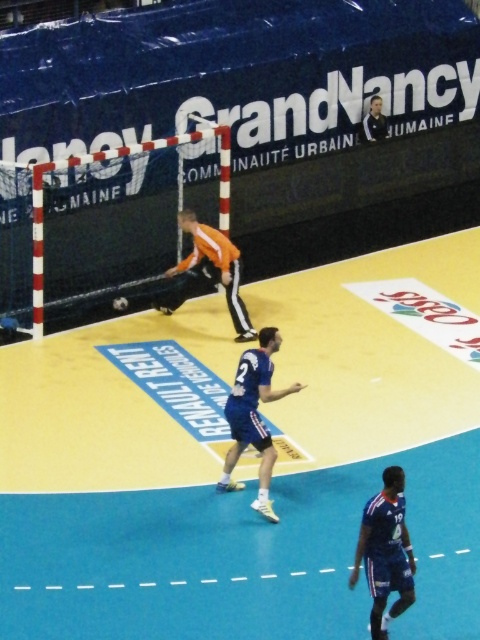
Question: Which object appears farthest from the camera in this image?

Choices:
 (A) blue fabric jersey at lower right
 (B) blue fabric jersey at center
 (C) orange jersey at center

Answer: (C)

Question: Can you confirm if blue synthetic court at center is thinner than blue fabric jersey at lower right?

Choices:
 (A) no
 (B) yes

Answer: (A)

Question: Is the position of blue fabric jersey at center less distant than that of orange jersey at center?

Choices:
 (A) yes
 (B) no

Answer: (A)

Question: Which point is farther from the camera taking this photo?

Choices:
 (A) [365, 131]
 (B) [381, 323]
 (C) [275, 337]

Answer: (A)

Question: Does blue synthetic court at center appear over dark blue jersey at upper right?

Choices:
 (A) yes
 (B) no

Answer: (B)

Question: Which object is positioned closest to the dark blue jersey at upper right?

Choices:
 (A) blue fabric jersey at center
 (B) blue fabric jersey at lower right

Answer: (A)